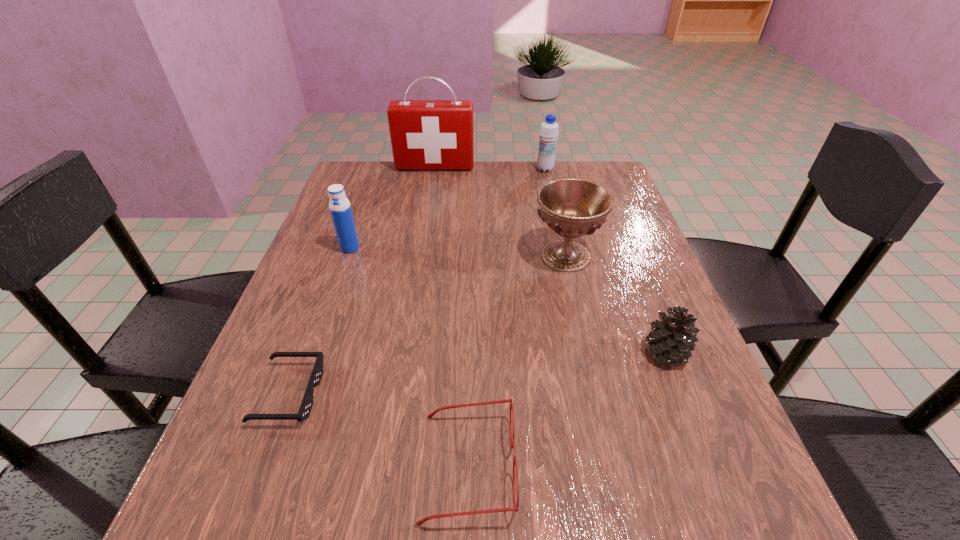
Image resolution: width=960 pixels, height=540 pixels. I want to click on unoccupied area between the rightmost object and the sunglasses, so click(477, 373).

Find the location of a particular element. The height and width of the screenshot is (540, 960). unoccupied area between the farther water bottle and the nearer water bottle is located at coordinates (447, 208).

Identify the location of free space between the chalice and the shortest object. (427, 325).

Locate an element on the screen. Image resolution: width=960 pixels, height=540 pixels. vacant area between the first-aid kit and the shortest object is located at coordinates (362, 280).

Where is `free area in between the right water bottle and the sixth tallest object`? free area in between the right water bottle and the sixth tallest object is located at coordinates (507, 318).

Locate an element on the screen. Image resolution: width=960 pixels, height=540 pixels. vacant area between the chalice and the left water bottle is located at coordinates (458, 252).

The image size is (960, 540). In order to click on free area in between the right water bottle and the left water bottle in this screenshot , I will do pyautogui.click(x=447, y=208).

I want to click on object that stands as the second closest to the nearer water bottle, so click(425, 134).

Locate which object ranks in proximity to the nearer water bottle. Please provide its 2D coordinates. Your answer should be formatted as a tuple, i.e. [(x, y)], where the tuple contains the x and y coordinates of a point satisfying the conditions above.

[(304, 411)]

Locate an element on the screen. The width and height of the screenshot is (960, 540). free location that satisfies the following two spatial constraints: 1. on the front side of the right water bottle; 2. on the face of the second shortest object is located at coordinates (612, 465).